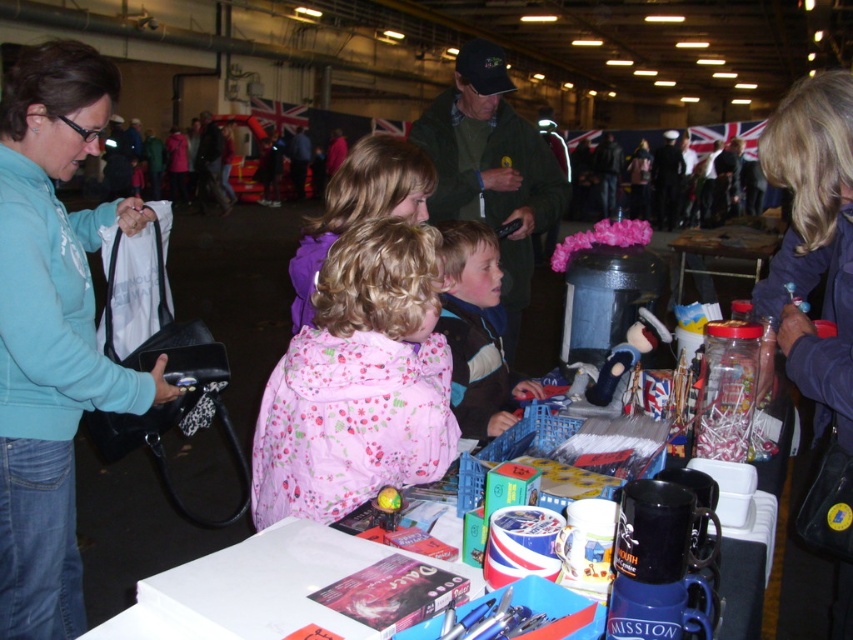
Between green textured jacket at upper center and wooden table at center, which one is positioned lower?

green textured jacket at upper center is below.

Image resolution: width=853 pixels, height=640 pixels. What do you see at coordinates (491, 168) in the screenshot?
I see `green textured jacket at upper center` at bounding box center [491, 168].

Where is `green textured jacket at upper center`? green textured jacket at upper center is located at coordinates (491, 168).

Describe the element at coordinates (491, 168) in the screenshot. I see `green textured jacket at upper center` at that location.

Does green textured jacket at upper center come behind striped fleece jacket at center?

Yes, green textured jacket at upper center is behind striped fleece jacket at center.

Who is more distant from viewer, (463,160) or (532,390)?

Positioned behind is point (463,160).

Image resolution: width=853 pixels, height=640 pixels. Identify the location of green textured jacket at upper center. (491, 168).

Does teal fabric jacket at left appear on the right side of white plastic table at center?

No, teal fabric jacket at left is not to the right of white plastic table at center.

Who is lower down, teal fabric jacket at left or white plastic table at center?

white plastic table at center is lower down.

Where is `teal fabric jacket at left`? The image size is (853, 640). teal fabric jacket at left is located at coordinates (51, 330).